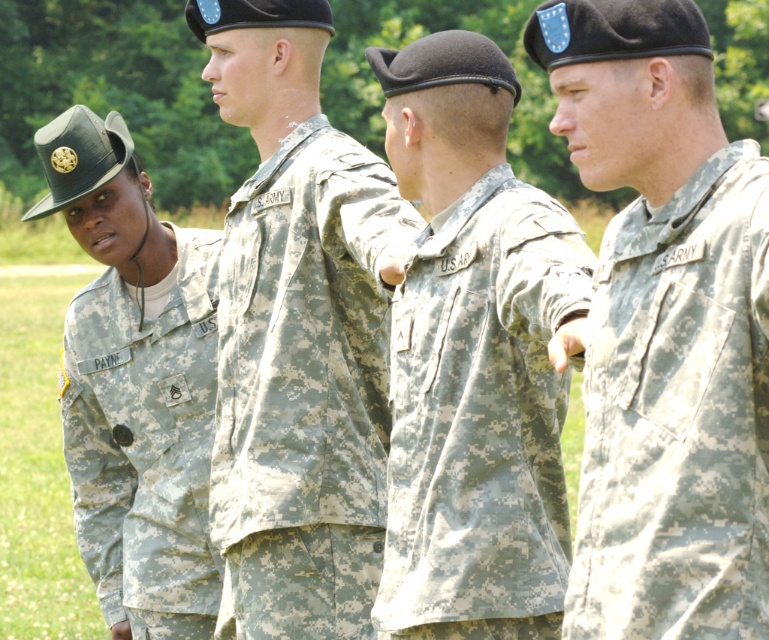
This screenshot has height=640, width=769. What are the coordinates of `camouflage fabric uniform at center` in the screenshot? It's located at (305, 387).

Is point (355, 628) positioned before point (118, 321)?

That is True.

I want to click on camouflage fabric uniform at center, so click(305, 387).

Who is positioned more to the right, camouflage fabric at center or camouflage fabric uniform at left?

Positioned to the right is camouflage fabric at center.

Consider the image. Measure the distance between camouflage fabric at center and camera.

camouflage fabric at center and camera are 24.33 feet apart from each other.

I want to click on camouflage fabric at center, so pyautogui.click(x=480, y=417).

Is camouflage fabric uniform at right further to camera compared to camouflage fabric at center?

No, camouflage fabric uniform at right is closer to the viewer.

Who is shorter, camouflage fabric uniform at right or camouflage fabric at center?

camouflage fabric uniform at right is shorter.

Between point (658, 481) and point (548, 300), which one is positioned behind?

Point (548, 300)

Image resolution: width=769 pixels, height=640 pixels. In order to click on camouflage fabric uniform at right in this screenshot , I will do `click(677, 416)`.